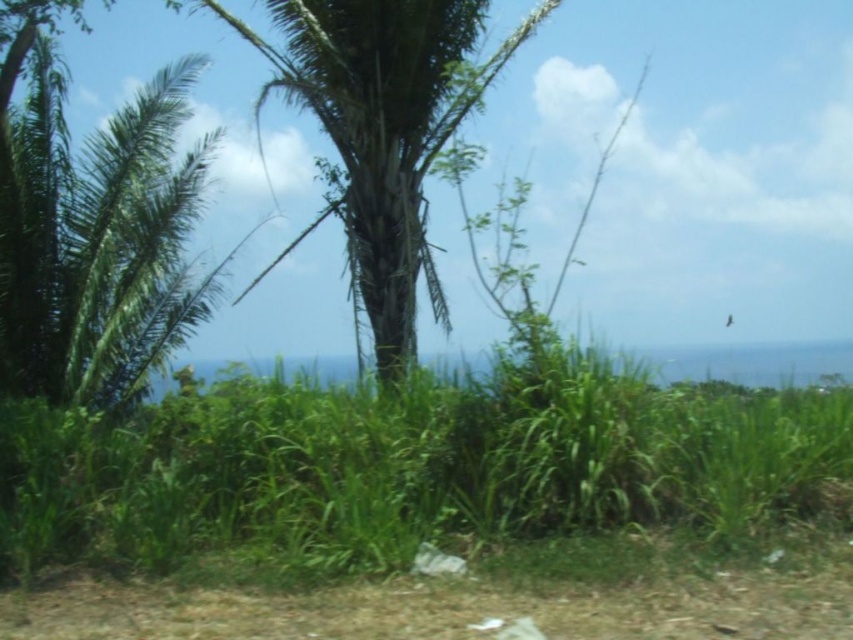
Who is positioned more to the right, green leafy grass at lower center or green leafy palm tree at center?

green leafy grass at lower center is more to the right.

Does point (210, 449) come behind point (340, 20)?

No, it is not.

Between point (262, 536) and point (271, 65), which one is positioned behind?

Positioned behind is point (271, 65).

Find the location of a particular element. This screenshot has width=853, height=640. green leafy grass at lower center is located at coordinates (410, 465).